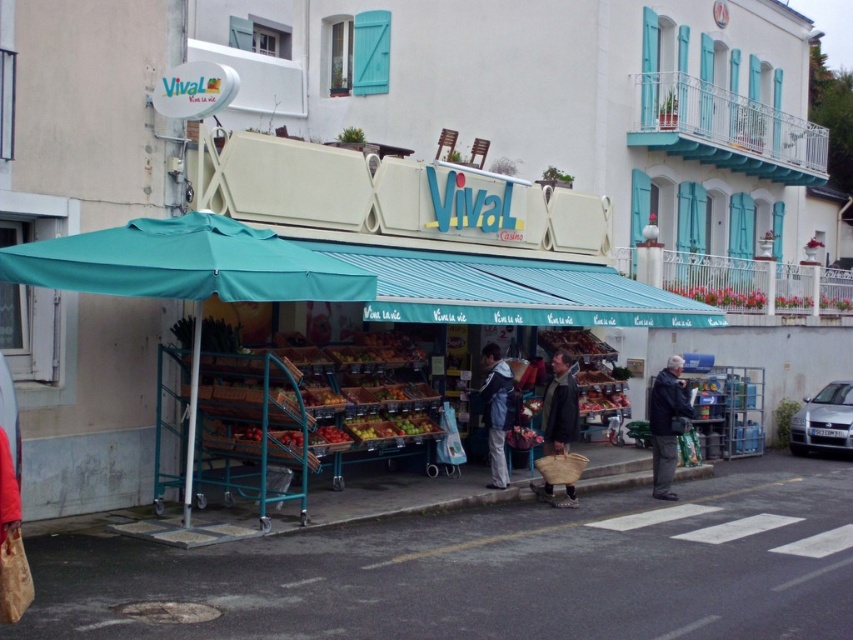
Is brown canvas bag at center bigger than blue denim jacket at center?

Actually, brown canvas bag at center might be smaller than blue denim jacket at center.

Is the position of brown canvas bag at center more distant than that of blue denim jacket at center?

That is False.

At what (x,y) coordinates should I click in order to perform the action: click on brown canvas bag at center. Please return your answer as a coordinate pair (x, y). Looking at the image, I should click on (560, 404).

This screenshot has height=640, width=853. Find the location of `brown canvas bag at center`. brown canvas bag at center is located at coordinates (560, 404).

Is dark blue jacket at lower right to the right of blue denim jacket at center from the viewer's perspective?

Indeed, dark blue jacket at lower right is positioned on the right side of blue denim jacket at center.

Which is in front, point (650, 404) or point (503, 406)?

Point (503, 406) is more forward.

Locate an element on the screen. dark blue jacket at lower right is located at coordinates (666, 424).

Can you confirm if teal fabric umbrella at center is bigger than blue denim jacket at center?

Yes, teal fabric umbrella at center is bigger than blue denim jacket at center.

Does teal fabric umbrella at center have a greater height compared to blue denim jacket at center?

No, teal fabric umbrella at center is not taller than blue denim jacket at center.

The height and width of the screenshot is (640, 853). What do you see at coordinates (186, 272) in the screenshot? I see `teal fabric umbrella at center` at bounding box center [186, 272].

At what (x,y) coordinates should I click in order to perform the action: click on teal fabric umbrella at center. Please return your answer as a coordinate pair (x, y). This screenshot has height=640, width=853. Looking at the image, I should click on (186, 272).